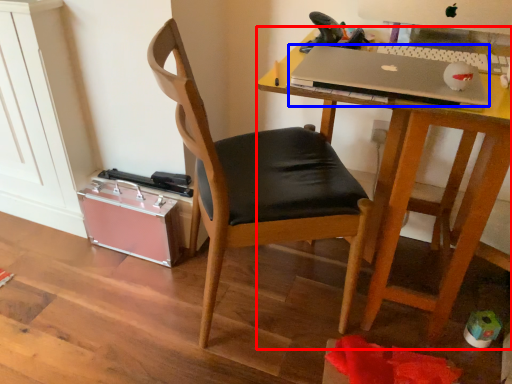
Question: Among these objects, which one is farthest to the camera, desk (highlighted by a red box) or laptop (highlighted by a blue box)?

Choices:
 (A) desk
 (B) laptop

Answer: (B)